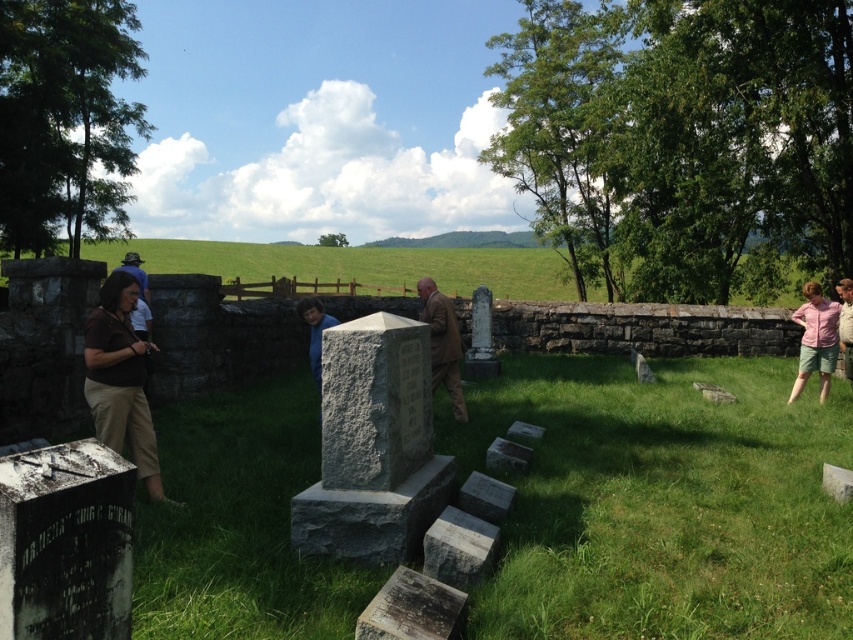
In the scene shown: You are standing at the entrance of the cemetery and want to reach the green grassy field at center. Which direction should you walk to reach it?

The green grassy field at center is located at coordinates approximately 0.414 on the x and 0.419 on the y axis, so you should walk towards the center of the cemetery to reach it.

You are standing in the cemetery and want to take a photo of the green grassy field at center and the pink cotton shirt at right. Which object should you focus on first if you want both to be in clear focus?

The green grassy field at center is taller than the pink cotton shirt at right, so you should focus on the green grassy field at center first to ensure both are in focus.